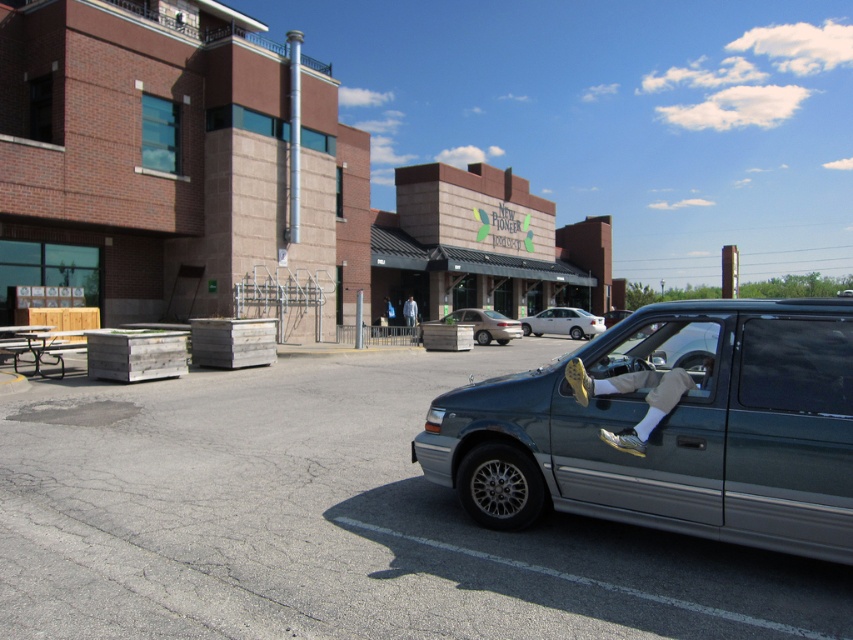
Is green painted metal picnic table at left to the right of white glossy sedan at center from the viewer's perspective?

No, green painted metal picnic table at left is not to the right of white glossy sedan at center.

Who is shorter, green painted metal picnic table at left or white glossy sedan at center?

green painted metal picnic table at left is shorter.

Is point (57, 356) positioned after point (590, 330)?

No.

Find the location of a particular element. green painted metal picnic table at left is located at coordinates (33, 346).

Can you confirm if asphalt at center is bigger than white glossy sedan at center?

Actually, asphalt at center might be smaller than white glossy sedan at center.

Describe the element at coordinates (334, 522) in the screenshot. I see `asphalt at center` at that location.

You are a GUI agent. You are given a task and a screenshot of the screen. Output one action in this format:
    pyautogui.click(x=<x>, y=<y>)
    Task: Click on the asphalt at center
    The width and height of the screenshot is (853, 640).
    Given the screenshot: What is the action you would take?
    tap(334, 522)

The width and height of the screenshot is (853, 640). I want to click on asphalt at center, so click(334, 522).

Who is shorter, metallic green minivan at right or white glossy sedan at center?

metallic green minivan at right

Is point (747, 332) in front of point (540, 326)?

Yes, it is.

You are a GUI agent. You are given a task and a screenshot of the screen. Output one action in this format:
    pyautogui.click(x=<x>, y=<y>)
    Task: Click on the metallic green minivan at right
    This screenshot has height=640, width=853.
    Given the screenshot: What is the action you would take?
    (670, 428)